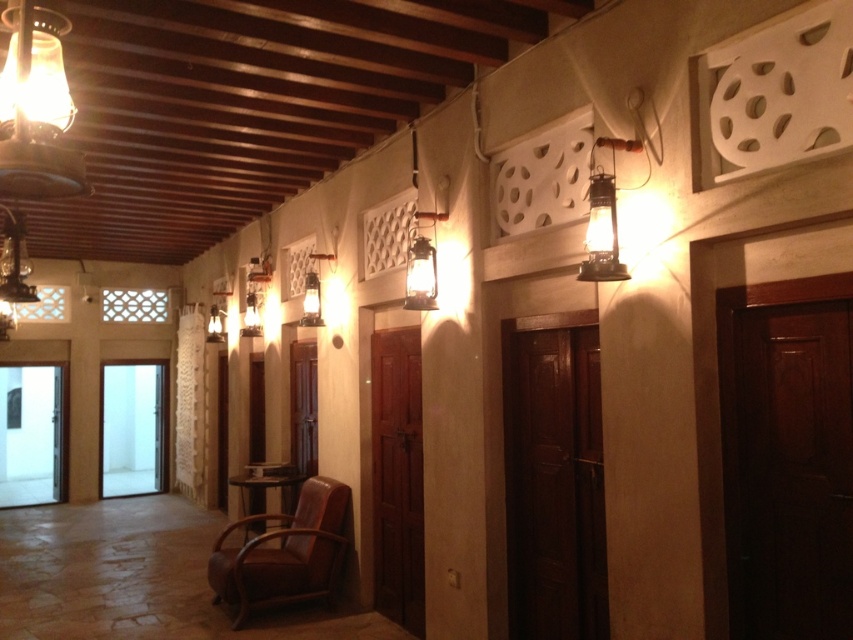
You are a guest in this hallway and want to sit down. There is a brown leather armchair at center and a metallic lantern at upper right. Which object is bigger and more suitable for sitting?

The brown leather armchair at center is larger than the metallic lantern at upper right, so it is more suitable for sitting.